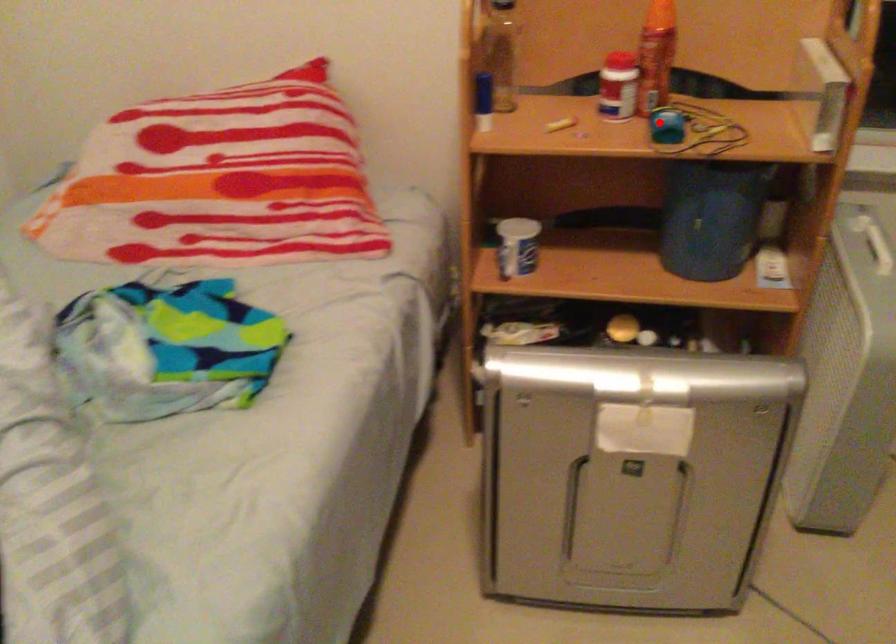
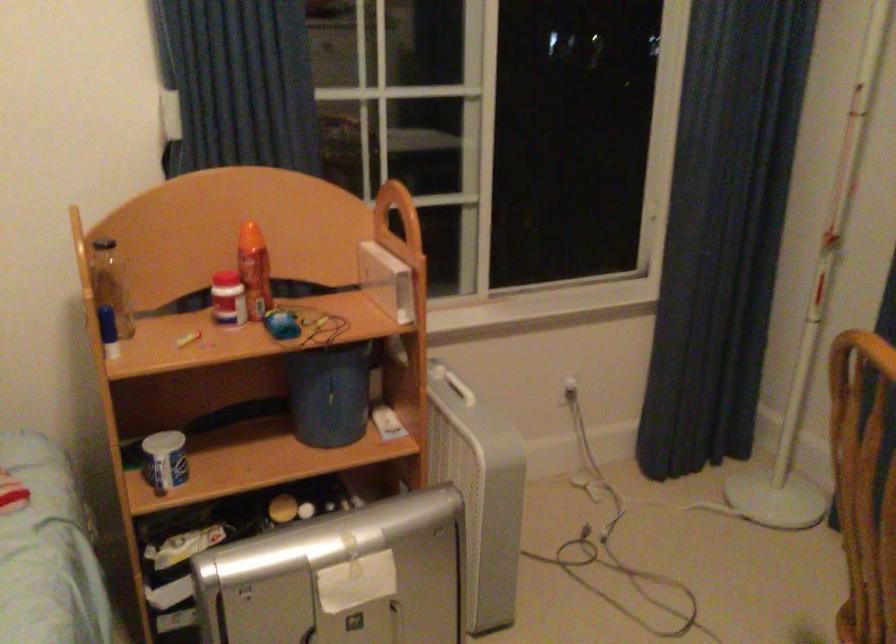
Question: I am providing you with two images of the same scene from different viewpoints. Given a red point in image1, look at the same physical point in image2. Is it:

Choices:
 (A) Closer to the viewpoint
 (B) Farther from the viewpoint

Answer: (B)